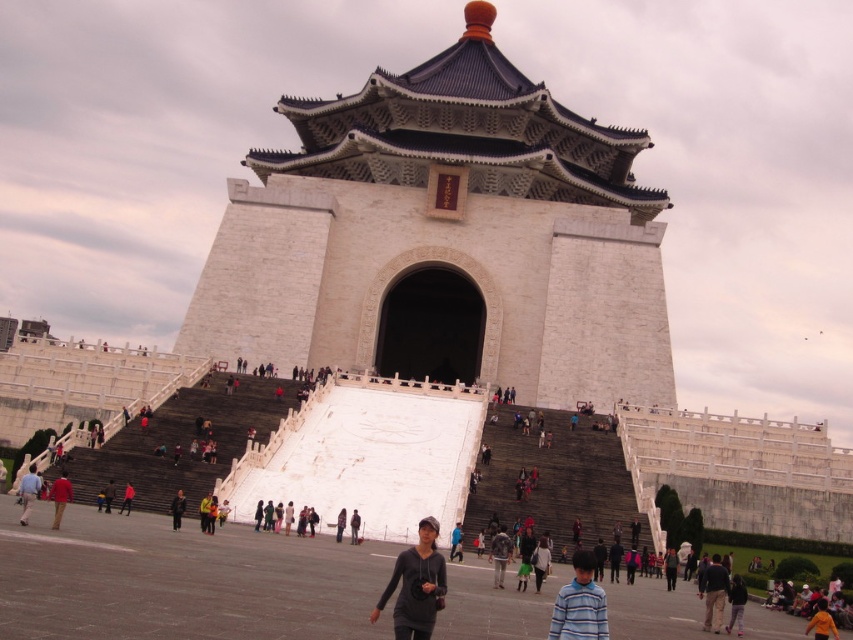
In the scene shown: Who is higher up, orange fabric at lower right or dark gray sweater at center?

Positioned higher is orange fabric at lower right.

In the scene shown: Which is more to the left, orange fabric at lower right or dark gray sweater at center?

dark gray sweater at center

The height and width of the screenshot is (640, 853). Find the location of `orange fabric at lower right`. orange fabric at lower right is located at coordinates (821, 621).

The image size is (853, 640). I want to click on dark gray sweater at lower right, so click(735, 604).

Is dark gray sweater at lower right above dark blue jeans at center?

No, dark gray sweater at lower right is not above dark blue jeans at center.

I want to click on dark gray sweater at lower right, so click(x=735, y=604).

Does white stone monument at center appear over dark gray sweater at lower left?

Indeed, white stone monument at center is positioned over dark gray sweater at lower left.

Who is shorter, white stone monument at center or dark gray sweater at lower left?

With less height is dark gray sweater at lower left.

Is point (582, 289) behind point (22, 509)?

Yes, it is behind point (22, 509).

Find the location of a particular element. This screenshot has width=853, height=640. white stone monument at center is located at coordinates (445, 240).